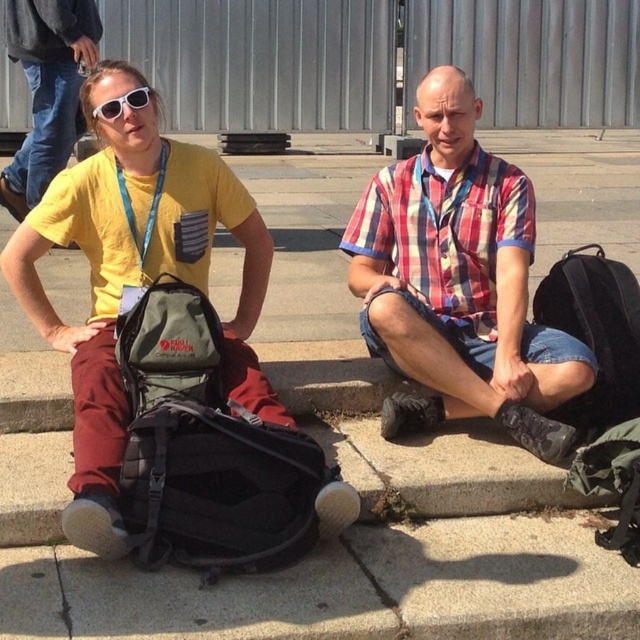
You are a photographer trying to capture a candid shot of the two people on the steps. You want to ensure that both the plaid cotton shirt at center and the matte black backpack at center are clearly visible in the frame. Given their relative heights, which object should you focus on first to ensure proper focus and composition?

The plaid cotton shirt at center has a greater height compared to the matte black backpack at center, so focusing on the plaid cotton shirt at center first will ensure proper focus and composition since it is taller and likely more prominent in the scene.